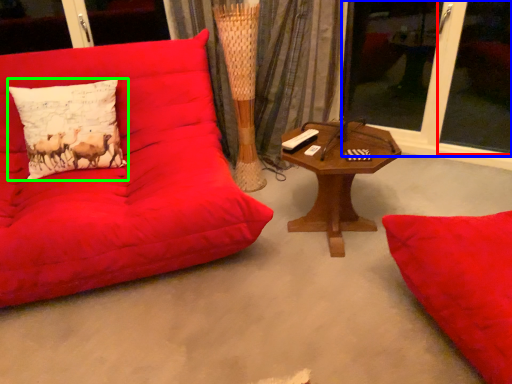
Question: Which object is the farthest from window screen (highlighted by a red box)? Choose among these: window screen (highlighted by a blue box) or pillow (highlighted by a green box).

Choices:
 (A) window screen
 (B) pillow

Answer: (B)